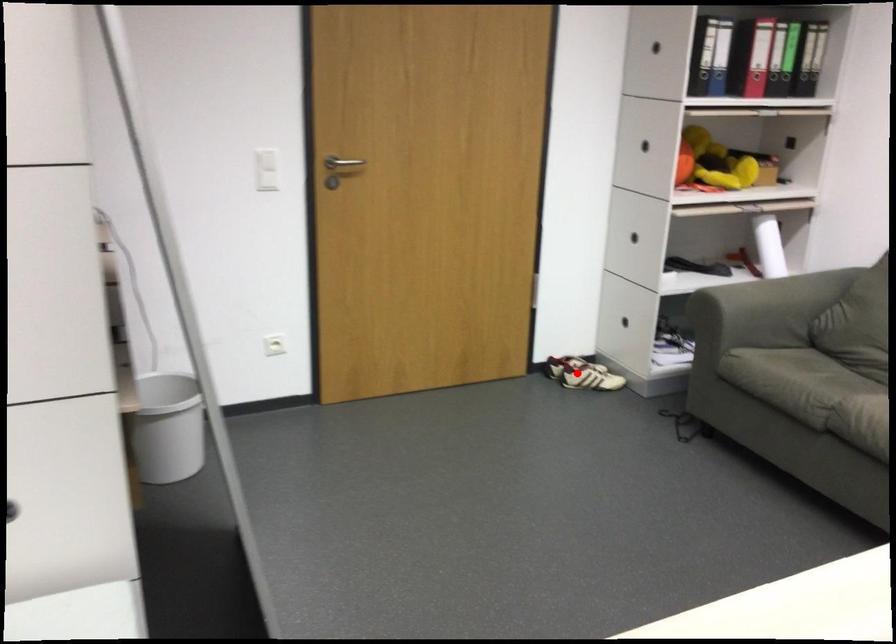
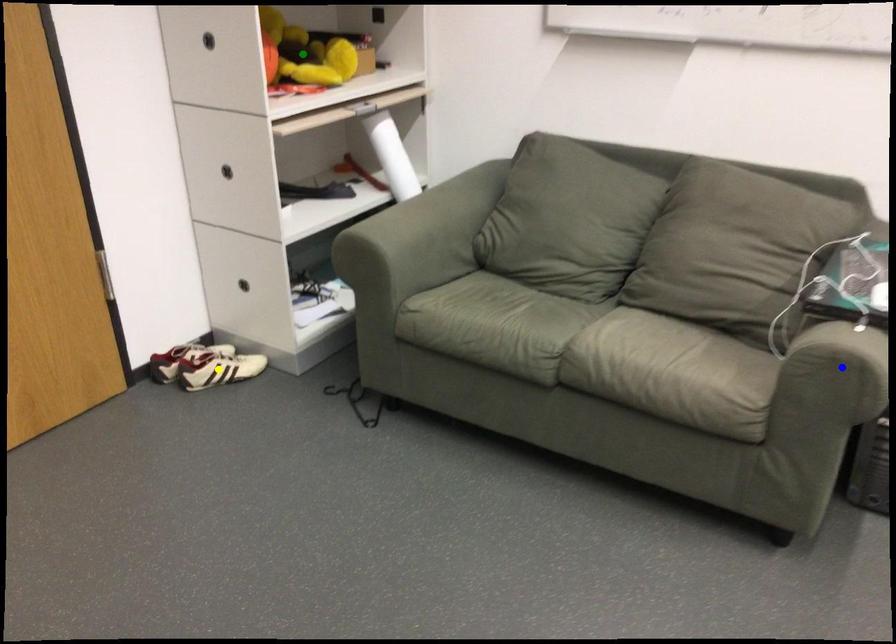
Question: I am providing you with two images of the same scene from different viewpoints. A red point is marked on the first image. You are given multiple points on the second image. Which point in image 2 is actually the same real-world point as the red point in image 1?

Choices:
 (A) blue point
 (B) green point
 (C) yellow point

Answer: (C)